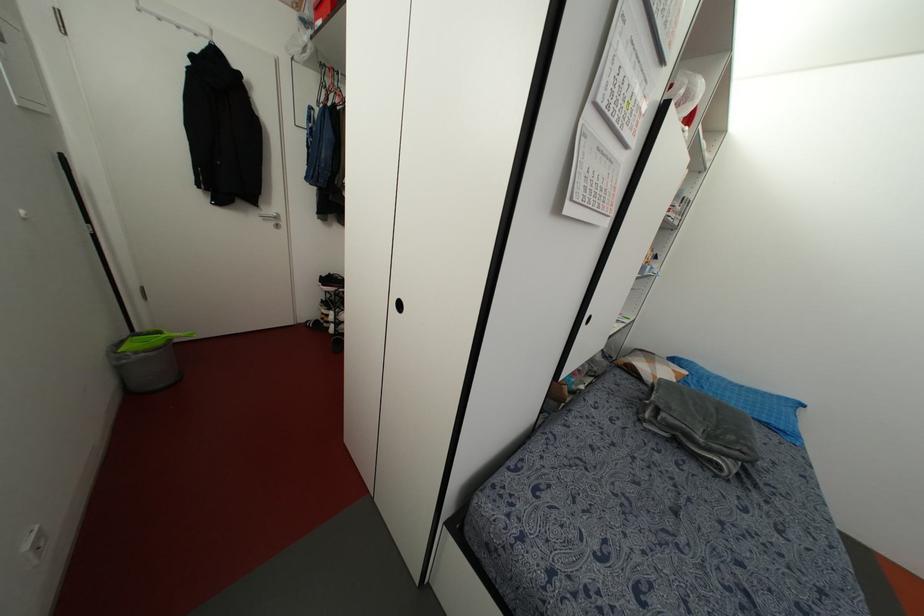
Locate an element on the screen. The image size is (924, 616). silver door handle is located at coordinates (x=272, y=219).